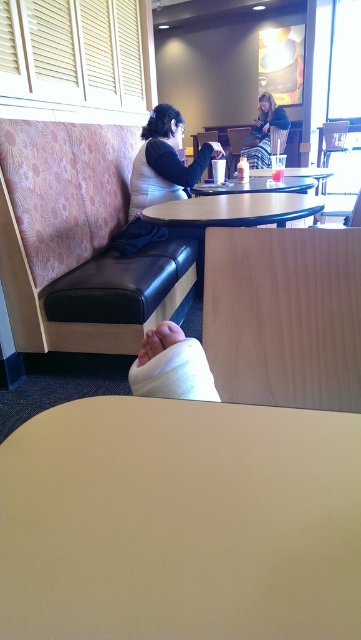
Question: Is the position of matte white shirt at center more distant than that of white plastic table at center?

Choices:
 (A) no
 (B) yes

Answer: (B)

Question: Estimate the real-world distances between objects in this image. Which object is farther from the plaid skirt at center?

Choices:
 (A) white plastic table at center
 (B) matte white shirt at center
 (C) beige matte table at center
 (D) pink fabric couch at left

Answer: (C)

Question: Does smooth white table at center have a larger size compared to plaid skirt at center?

Choices:
 (A) no
 (B) yes

Answer: (A)

Question: Which point is closer to the camera?

Choices:
 (A) (2, 552)
 (B) (24, 252)
 (C) (162, 104)
 (D) (219, 220)

Answer: (A)

Question: Among these objects, which one is farthest from the camera?

Choices:
 (A) plaid skirt at center
 (B) smooth white table at center

Answer: (A)

Question: Does beige matte table at center lie behind white plastic table at center?

Choices:
 (A) yes
 (B) no

Answer: (B)